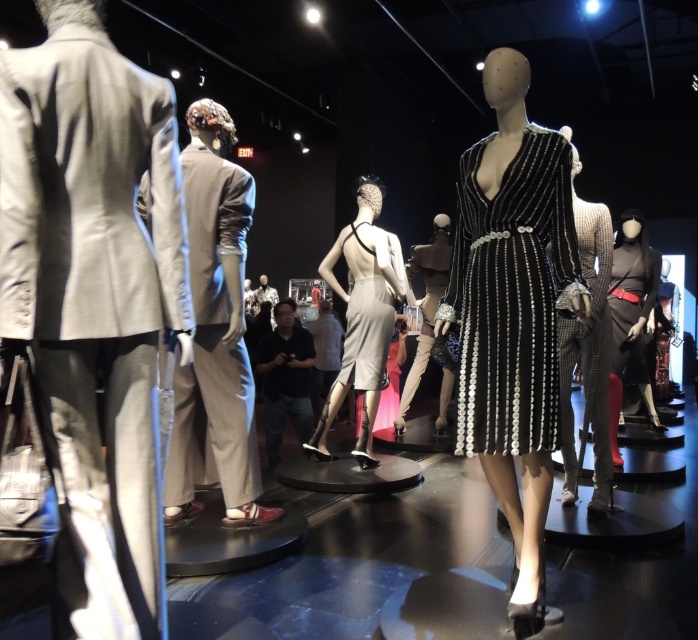
Which is above, matte gray suit at left or black sequined dress at center?

black sequined dress at center is above.

Between matte gray suit at left and black sequined dress at center, which one has more height?

Standing taller between the two is matte gray suit at left.

Is point (119, 214) positioned after point (496, 214)?

No, it is in front of (496, 214).

Where is `matte gray suit at left`? Image resolution: width=698 pixels, height=640 pixels. matte gray suit at left is located at coordinates (94, 300).

Can you confirm if satin grey dress at center is thinner than satin silver clutch at center?

Yes, satin grey dress at center is thinner than satin silver clutch at center.

Between point (383, 275) and point (452, 378), which one is positioned behind?

The point (452, 378) is more distant.

Is point (393, 257) positioned behind point (413, 272)?

No, it is not.

Locate an element on the screen. satin grey dress at center is located at coordinates (366, 332).

Who is lower down, black sequined dress at center or shiny metallic dress at center?

Positioned lower is shiny metallic dress at center.

Can you confirm if black sequined dress at center is wider than shiny metallic dress at center?

Incorrect, black sequined dress at center's width does not surpass shiny metallic dress at center's.

Between point (493, 337) and point (608, 259), which one is positioned behind?

Positioned behind is point (608, 259).

Image resolution: width=698 pixels, height=640 pixels. I want to click on black sequined dress at center, so click(510, 296).